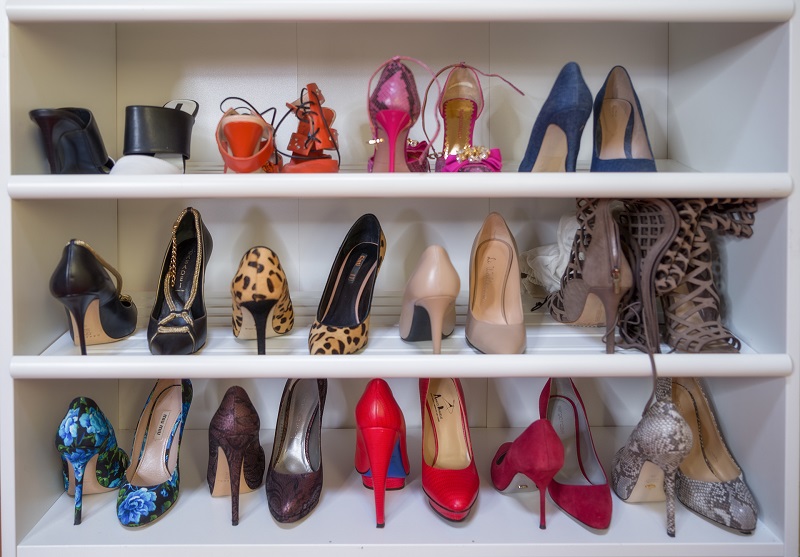
Locate an element on the screen. The image size is (800, 557). heels on middle shelf is located at coordinates (688, 282), (597, 273), (502, 310), (425, 295), (353, 309), (258, 304), (168, 307), (72, 294).